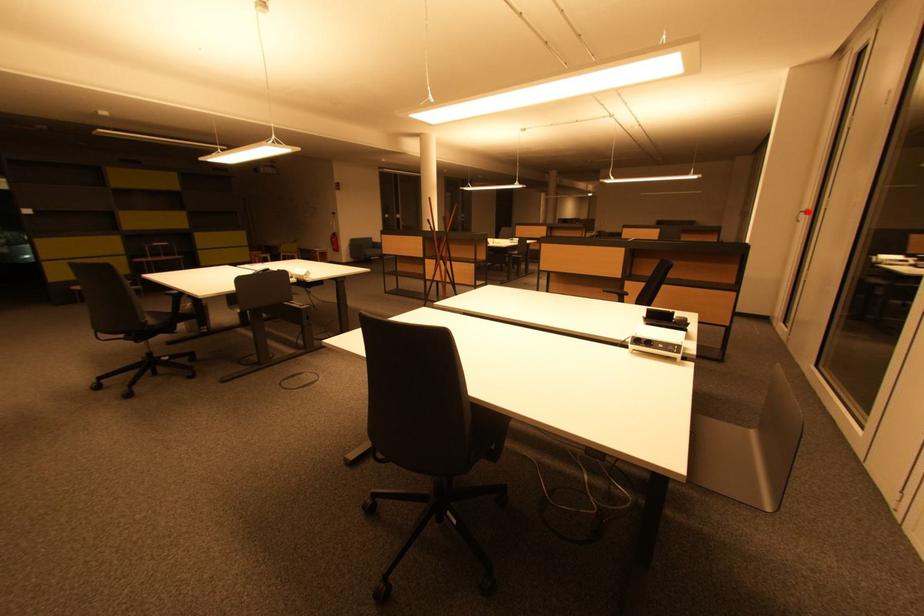
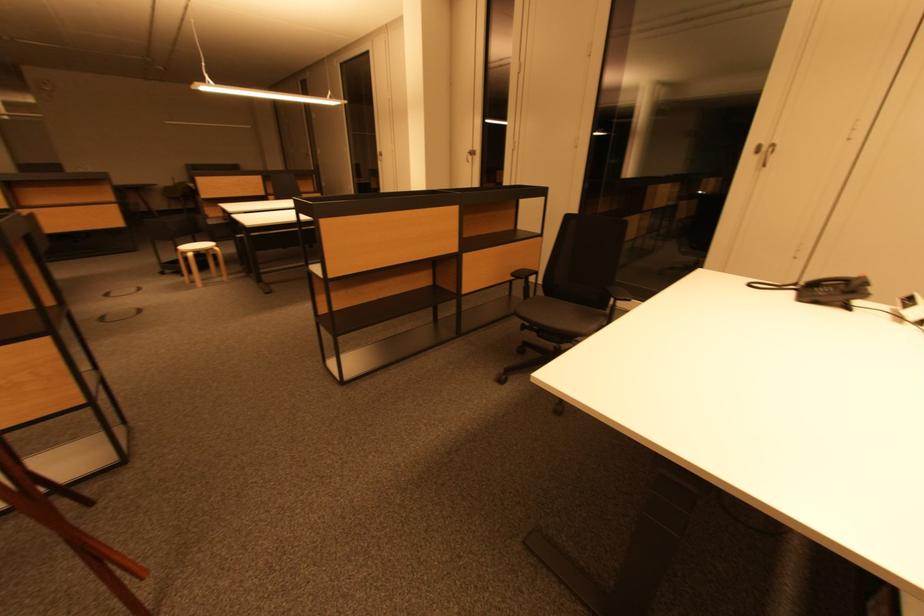
Question: A red point is marked in image1. In image2, is the corresponding 3D point closer to the camera or farther? Reply with the corresponding letter.

Choices:
 (A) The corresponding 3D point is closer.
 (B) The corresponding 3D point is farther.

Answer: (A)